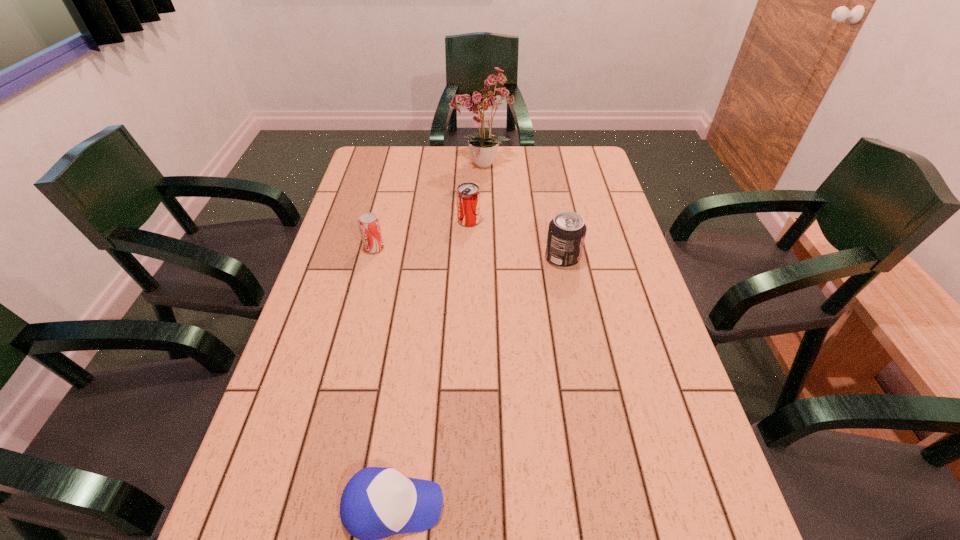
Where is `the tallest object`? the tallest object is located at coordinates (484, 101).

The image size is (960, 540). What are the coordinates of `flower arrangement` in the screenshot? It's located at (484, 101).

Identify the location of the rightmost object. (566, 234).

I want to click on the farthest soda can, so click(468, 195).

At what (x,y) coordinates should I click in order to perform the action: click on the second soda can from left to right. Please return your answer as a coordinate pair (x, y). This screenshot has height=540, width=960. Looking at the image, I should click on (468, 195).

Where is `the leftmost soda can`? Image resolution: width=960 pixels, height=540 pixels. the leftmost soda can is located at coordinates (369, 225).

You are a GUI agent. You are given a task and a screenshot of the screen. Output one action in this format:
    pyautogui.click(x=<x>, y=<y>)
    Task: Click on the vacant space located on the front-facing side of the tallest object
    
    Given the screenshot: What is the action you would take?
    pyautogui.click(x=386, y=165)

Locate an element on the screen. The width and height of the screenshot is (960, 540). free region located on the front-facing side of the tallest object is located at coordinates (396, 165).

The height and width of the screenshot is (540, 960). In order to click on vacant region located 0.180m on the front-facing side of the tallest object in this screenshot , I will do `click(399, 165)`.

Find the location of a particular element. This screenshot has height=540, width=960. vacant area situated on the front of the rightmost soda can is located at coordinates (585, 374).